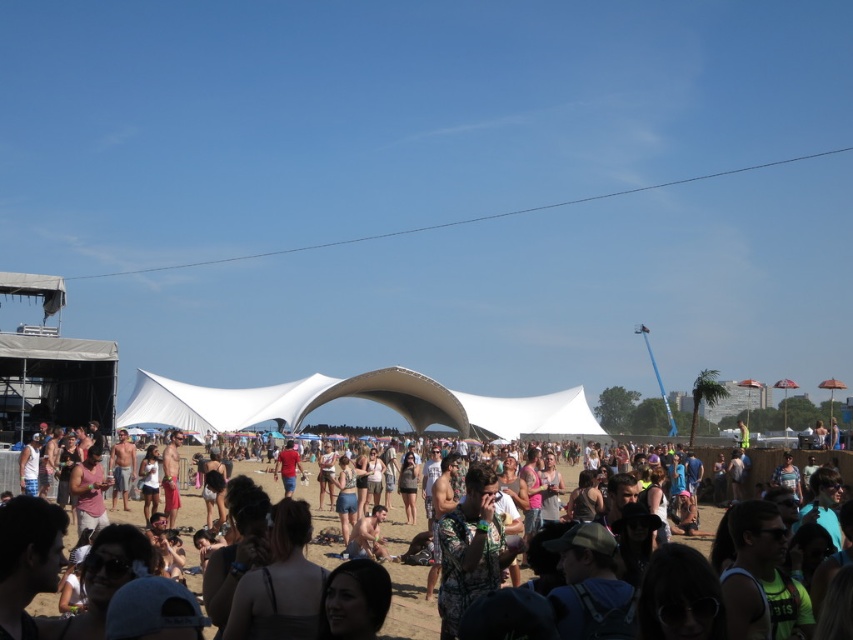
You are standing at the origin point of the coordinate system in the image. You want to walk towards the white fabric canopy at center. What direction should you move in?

Since the white fabric canopy at center is located at coordinate point 0.622 on the x axis and 0.421 on the y axis, you should move towards the right and slightly forward to reach it.

You are a photographer standing at the edge of the crowd. You want to take a photo of the white fabric canopy at center and the floral print shirt at center so that both are clearly visible in the frame. Given that your camera has a maximum focus range of 30 meters, will you be able to capture both objects in focus?

The white fabric canopy at center is 31.07 meters away from the floral print shirt at center. Since the distance between them exceeds the camera s maximum focus range of 30 meters, it may be difficult to keep both objects in focus simultaneously. You might need to adjust your position or use a different camera setting to ensure both are sharp.

You are a photographer standing at the front of the crowd. You want to take a photo of the white fabric canopy at center. Considering the distance, will you need a zoom lens to capture the entire structure in your shot?

The white fabric canopy at center is 154.10 meters away from the camera. A standard lens might struggle to capture the entire structure from that distance, so using a zoom lens would help to ensure the entire canopy is in frame.